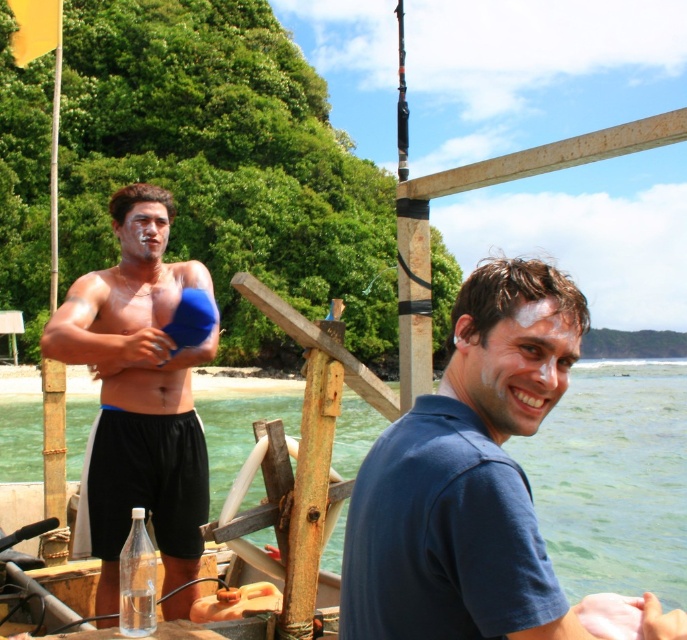
You are a lifeguard on duty and need to determine which object is higher in elevation between the clear water at boat right and the clear plastic bottle at center. Based on the scene, which one is taller?

The clear water at boat right is taller than the clear plastic bottle at center according to the description.

You are standing at the beach and want to reach the point marked at coordinates [475,416]. If you take a step forward of 1.5 meters, will you be closer to or farther from that point?

The point marked at coordinates [475,416] is 2.08 meters from the viewer. Taking a step forward of 1.5 meters would bring you to 0.58 meters away from the point, so you would be closer.